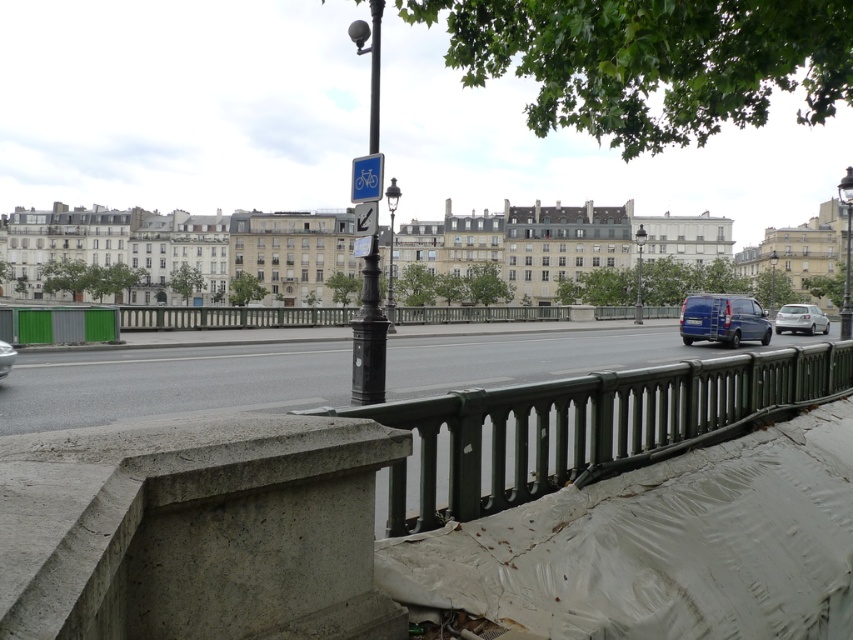
You are a delivery driver who needs to park your car between the black metal pole at center and the silver metallic hatchback at right. Is there enough space between them for your car, which is 4.5 meters long?

The black metal pole at center has a larger size compared to silver metallic hatchback at right. However, the exact distance between them is not provided in the scene description. Therefore, it is impossible to determine if there is enough space for a 4.5 meter car.

You are a photographer trying to capture a wide shot of the road from the bridge. You need to know which vehicle takes up more horizontal space in the frame. Which one is wider between the silver metallic hatchback at right and the metallic silver car at lower left?

The silver metallic hatchback at right is wider than the metallic silver car at lower left according to the description.

You are standing on the bridge and want to take a photo of the green metal railing at center. Which direction should you face to ensure the railing is in the center of your camera view?

The green metal railing at center is located at point [592,424], so you should face towards the coordinates [592,424] to center it in your camera view.